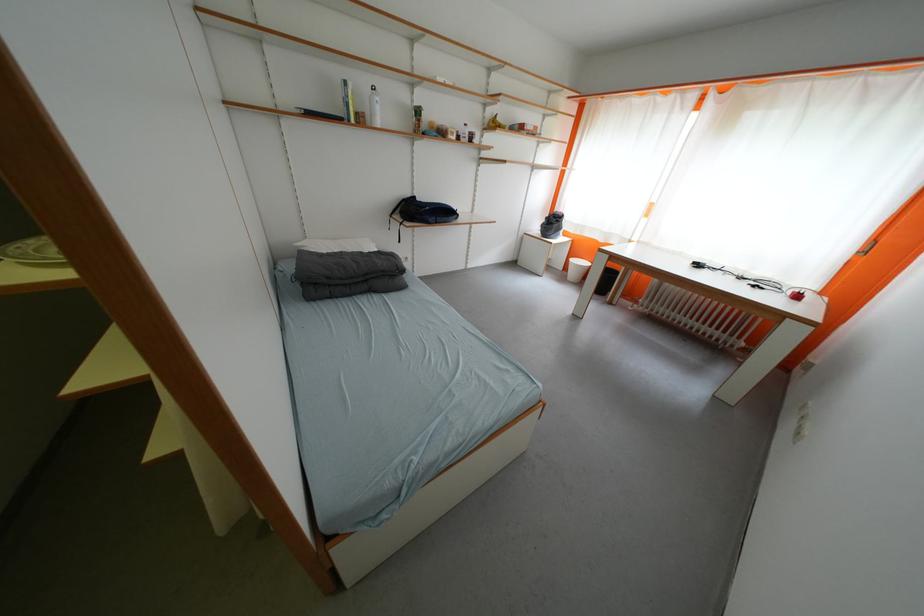
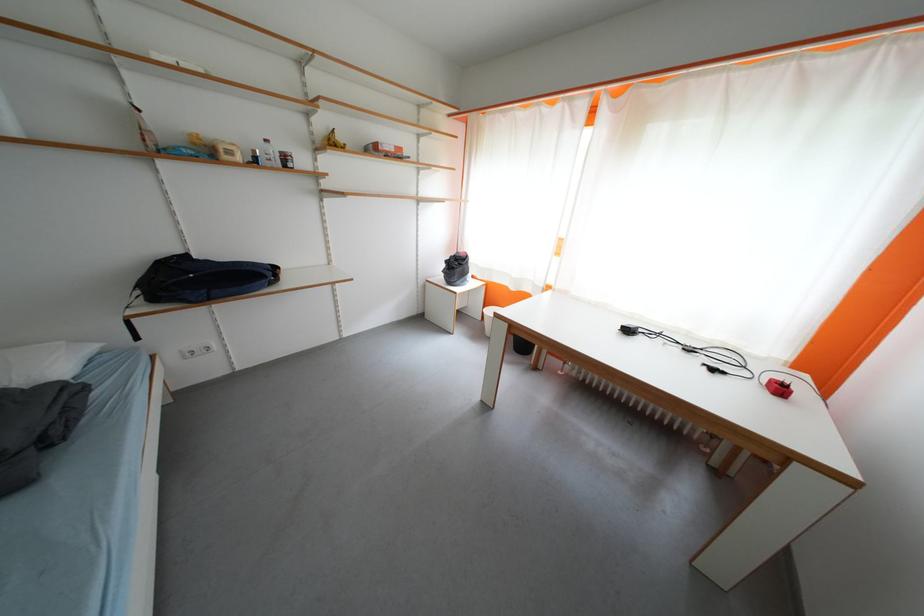
In a continuous first-person perspective shot, in which direction is the camera moving?

The cameraman moved toward right, forward.